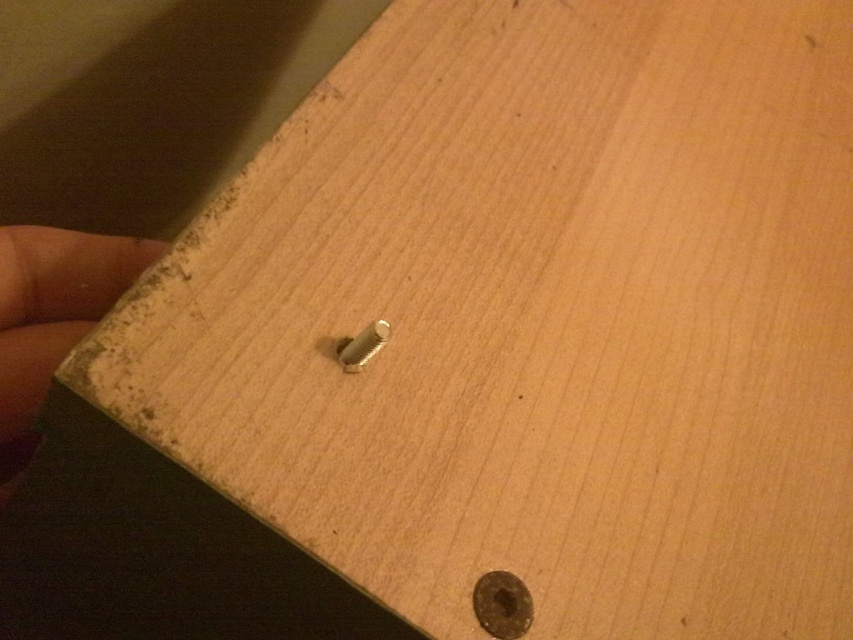
Question: Among these objects, which one is farthest from the camera?

Choices:
 (A) brown leather hand at left
 (B) gold metallic bolt at center
 (C) silver metallic bolt at center

Answer: (A)

Question: Which point appears farthest from the camera in this image?

Choices:
 (A) (158, 248)
 (B) (509, 584)

Answer: (A)

Question: Can you confirm if brown leather hand at left is wider than silver metallic bolt at center?

Choices:
 (A) no
 (B) yes

Answer: (B)

Question: Estimate the real-world distances between objects in this image. Which object is closer to the gold metallic bolt at center?

Choices:
 (A) silver metallic bolt at center
 (B) brown leather hand at left

Answer: (A)

Question: Is brown leather hand at left further to camera compared to silver metallic bolt at center?

Choices:
 (A) yes
 (B) no

Answer: (A)

Question: Where is brown leather hand at left located in relation to silver metallic bolt at center in the image?

Choices:
 (A) left
 (B) right

Answer: (A)